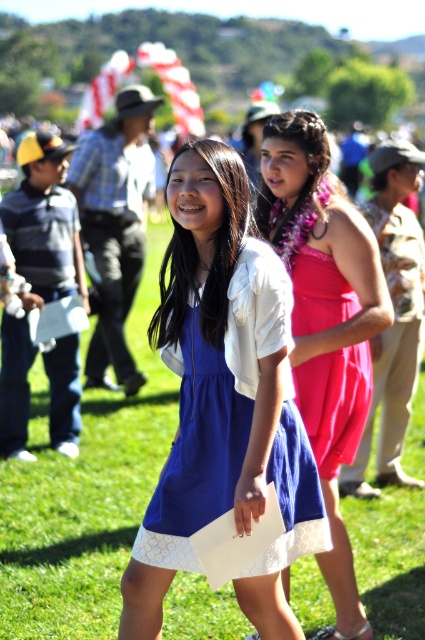
You are a photographer at a formal event. You need to capture a photo of both the blue satin dress at center and the pink satin dress at center. Which dress should you focus on first to ensure it fits properly in the frame?

The blue satin dress at center is bigger than the pink satin dress at center, so you should focus on the blue satin dress at center first to ensure it fits properly in the frame.

You are a photographer at a formal event. You need to position two models wearing the shiny pink dress at center and the blue satin dress at center so that they appear balanced in the frame. Given their heights, which dress should be placed in the front to maintain visual balance?

The shiny pink dress at center is taller than the blue satin dress at center, so to maintain visual balance, the shorter blue satin dress at center should be placed in the front to avoid overwhelming the composition with the taller dress at the back.